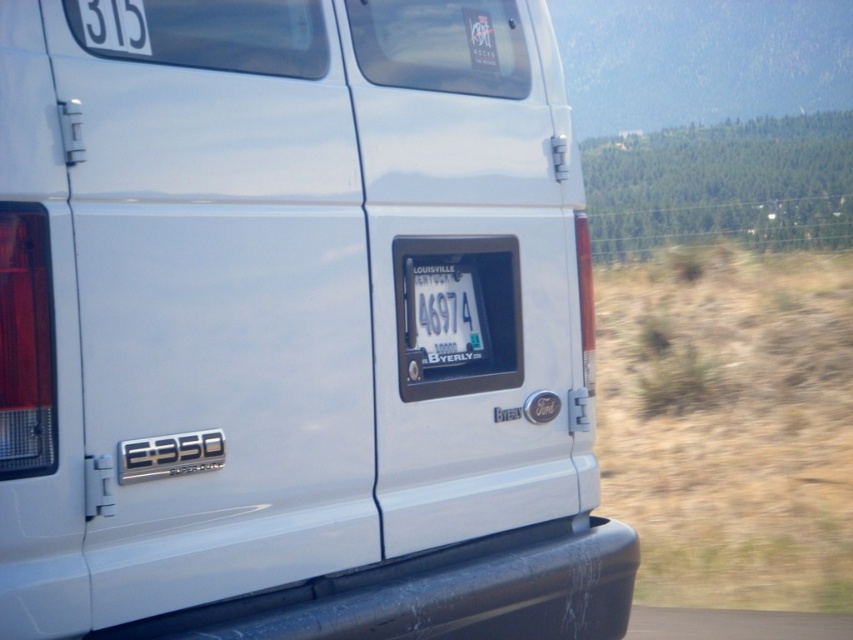
Is black rubber bumper at lower center positioned in front of white plastic license plate at center?

Yes, black rubber bumper at lower center is in front of white plastic license plate at center.

Which is more to the left, black rubber bumper at lower center or white plastic license plate at center?

Positioned to the left is black rubber bumper at lower center.

Does point (608, 620) come farther from viewer compared to point (454, 257)?

That is True.

I want to click on black rubber bumper at lower center, so click(440, 595).